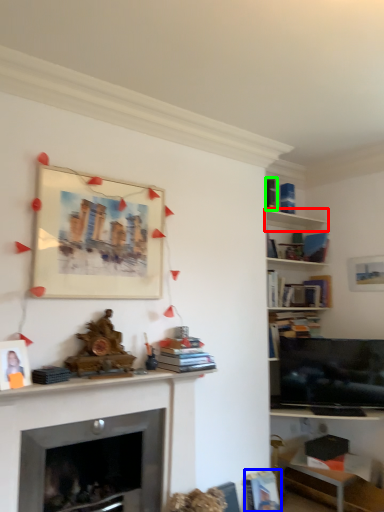
Question: Considering the real-world distances, which object is farthest from shelf (highlighted by a red box)? book (highlighted by a blue box) or book (highlighted by a green box)?

Choices:
 (A) book
 (B) book

Answer: (A)